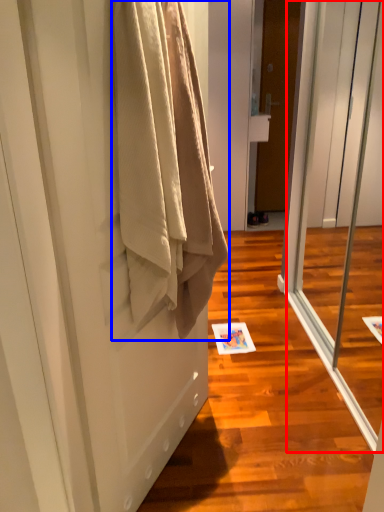
Question: Which object appears farthest to the camera in this image, screen door (highlighted by a red box) or towel (highlighted by a blue box)?

Choices:
 (A) screen door
 (B) towel

Answer: (A)